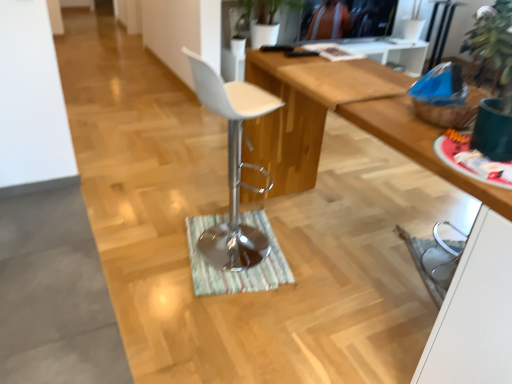
Question: Can you confirm if green striped mat at center is positioned to the right of white glossy cabinet at lower right?

Choices:
 (A) no
 (B) yes

Answer: (A)

Question: Is green striped mat at center with white glossy cabinet at lower right?

Choices:
 (A) yes
 (B) no

Answer: (B)

Question: Is green striped mat at center wider than white glossy cabinet at lower right?

Choices:
 (A) yes
 (B) no

Answer: (A)

Question: Considering the relative positions of green striped mat at center and white glossy cabinet at lower right in the image provided, is green striped mat at center behind white glossy cabinet at lower right?

Choices:
 (A) yes
 (B) no

Answer: (A)

Question: From a real-world perspective, does green striped mat at center stand above white glossy cabinet at lower right?

Choices:
 (A) no
 (B) yes

Answer: (A)

Question: Is green striped mat at center at the left side of white glossy cabinet at lower right?

Choices:
 (A) yes
 (B) no

Answer: (A)

Question: Is matte black television at upper center oriented away from white glossy cabinet at lower right?

Choices:
 (A) yes
 (B) no

Answer: (B)

Question: Is matte black television at upper center not close to white glossy cabinet at lower right?

Choices:
 (A) no
 (B) yes

Answer: (B)

Question: Considering the relative sizes of matte black television at upper center and white glossy cabinet at lower right in the image provided, is matte black television at upper center smaller than white glossy cabinet at lower right?

Choices:
 (A) yes
 (B) no

Answer: (A)

Question: Considering the relative sizes of matte black television at upper center and white glossy cabinet at lower right in the image provided, is matte black television at upper center bigger than white glossy cabinet at lower right?

Choices:
 (A) no
 (B) yes

Answer: (A)

Question: From the image's perspective, does matte black television at upper center appear higher than white glossy cabinet at lower right?

Choices:
 (A) yes
 (B) no

Answer: (A)

Question: From a real-world perspective, does matte black television at upper center sit lower than white glossy cabinet at lower right?

Choices:
 (A) no
 (B) yes

Answer: (A)

Question: Is wooden desk at center positioned in front of white glossy cabinet at lower right?

Choices:
 (A) yes
 (B) no

Answer: (B)